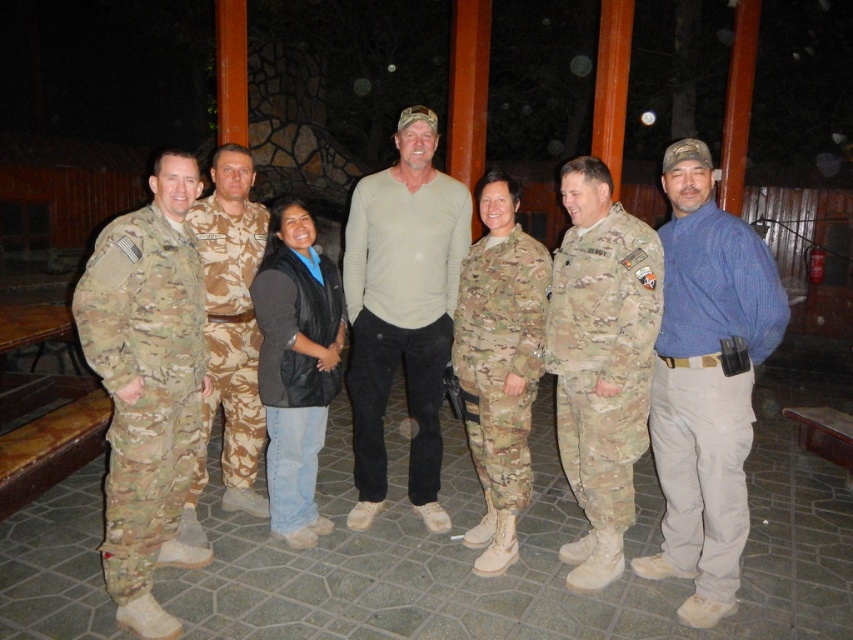
Question: Which of these objects is positioned farthest from the blue plaid shirt at center?

Choices:
 (A) camouflage fabric uniform at left
 (B) beige cotton shirt at center
 (C) camouflage fabric pants at center

Answer: (A)

Question: Which object is farther from the camera taking this photo?

Choices:
 (A) camouflage fabric uniform at left
 (B) camouflage fabric pants at center
 (C) camouflage fabric uniform at center
 (D) blue plaid shirt at center

Answer: (B)

Question: Does blue plaid shirt at center appear under black leather vest at center?

Choices:
 (A) no
 (B) yes

Answer: (A)

Question: Is blue plaid shirt at center wider than camouflage fabric pants at center?

Choices:
 (A) yes
 (B) no

Answer: (A)

Question: Based on their relative distances, which object is nearer to the beige cotton shirt at center?

Choices:
 (A) blue plaid shirt at center
 (B) camouflage fabric uniform at left
 (C) black leather vest at center
 (D) camouflage fabric uniform at center

Answer: (C)

Question: Is camouflage fabric pants at center below black leather vest at center?

Choices:
 (A) yes
 (B) no

Answer: (B)